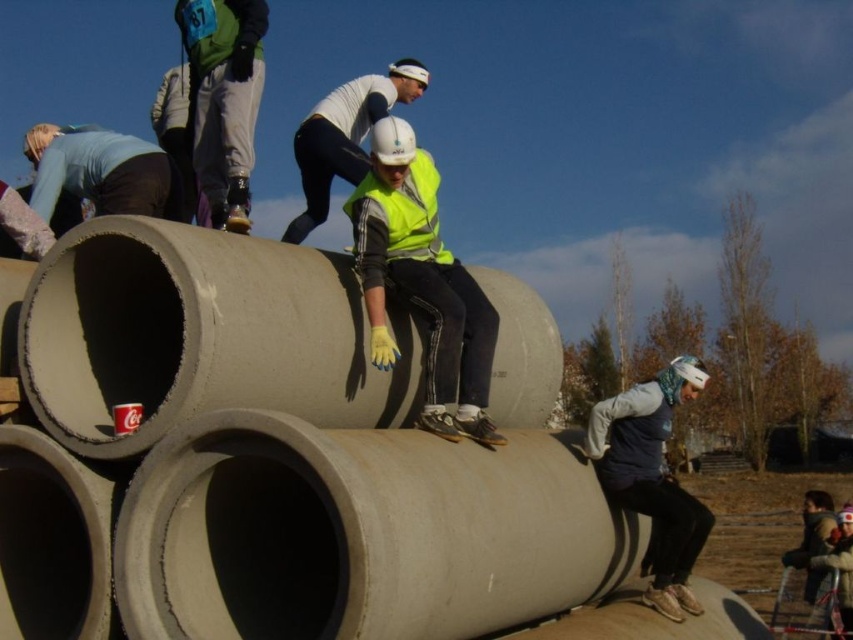
Who is higher up, green fabric bib at upper left or yellow reflective vest at center?

yellow reflective vest at center is above.

Can you confirm if green fabric bib at upper left is wider than yellow reflective vest at center?

In fact, green fabric bib at upper left might be narrower than yellow reflective vest at center.

Is point (215, 196) less distant than point (311, 211)?

Yes, point (215, 196) is closer to viewer.

This screenshot has width=853, height=640. Find the location of `green fabric bib at upper left`. green fabric bib at upper left is located at coordinates (223, 99).

Between point (606, 432) and point (312, 140), which one is positioned behind?

The point (606, 432) is behind.

Can you confirm if dark gray fabric beanie at lower right is positioned above yellow reflective vest at center?

No.

Between point (619, 412) and point (325, 188), which one is positioned in front?

Point (619, 412)

Image resolution: width=853 pixels, height=640 pixels. Identify the location of dark gray fabric beanie at lower right. (653, 476).

Between concrete pipe at center and neon yellow reflective vest at center, which one appears on the left side from the viewer's perspective?

concrete pipe at center

Does point (122, 392) come in front of point (384, 266)?

Yes.

Looking at this image, who is more distant from viewer, (370, 632) or (370, 244)?

Point (370, 244)

The width and height of the screenshot is (853, 640). I want to click on concrete pipe at center, so click(306, 445).